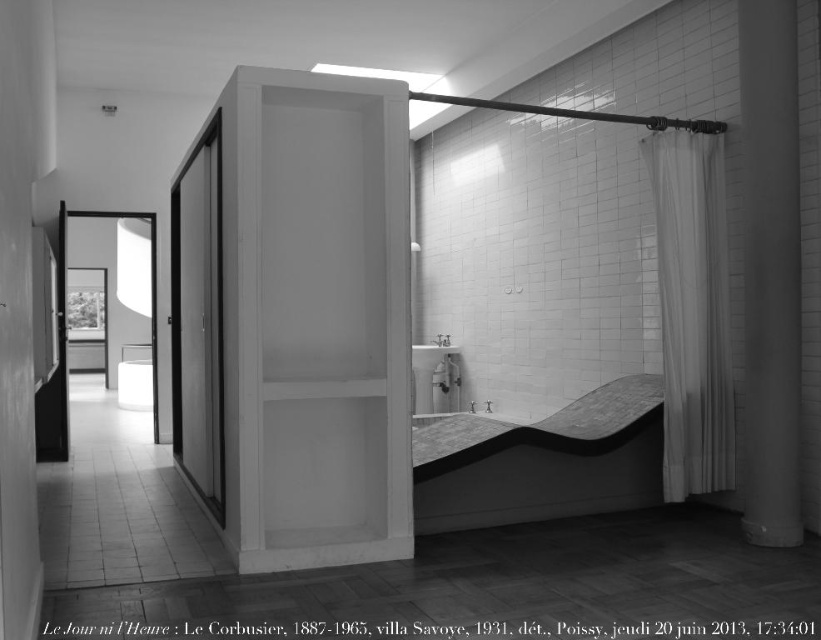
How far apart are smooth gray stone bathtub at lower right and white glossy sink at center?

smooth gray stone bathtub at lower right is 10.06 feet away from white glossy sink at center.

Does smooth gray stone bathtub at lower right appear on the right side of white glossy sink at center?

Yes, smooth gray stone bathtub at lower right is to the right of white glossy sink at center.

Who is more forward, (462, 417) or (437, 346)?

Point (462, 417) is in front.

Identify the location of smooth gray stone bathtub at lower right. (542, 461).

Does white sheer curtain at right have a lesser height compared to white glossy sink at center?

No, white sheer curtain at right is not shorter than white glossy sink at center.

Is white sheer curtain at right closer to camera compared to white glossy sink at center?

Yes, it is.

Does point (699, 388) come closer to viewer compared to point (420, 378)?

Yes, it is in front of point (420, 378).

Where is `white sheer curtain at right`? This screenshot has width=821, height=640. white sheer curtain at right is located at coordinates (691, 310).

Between point (644, 417) and point (705, 476), which one is positioned behind?

The point (644, 417) is behind.

Can you confirm if smooth gray stone bathtub at lower right is positioned to the right of white sheer curtain at right?

Incorrect, smooth gray stone bathtub at lower right is not on the right side of white sheer curtain at right.

Is point (613, 483) closer to camera compared to point (695, 202)?

No, (613, 483) is further to viewer.

Identify the location of smooth gray stone bathtub at lower right. (542, 461).